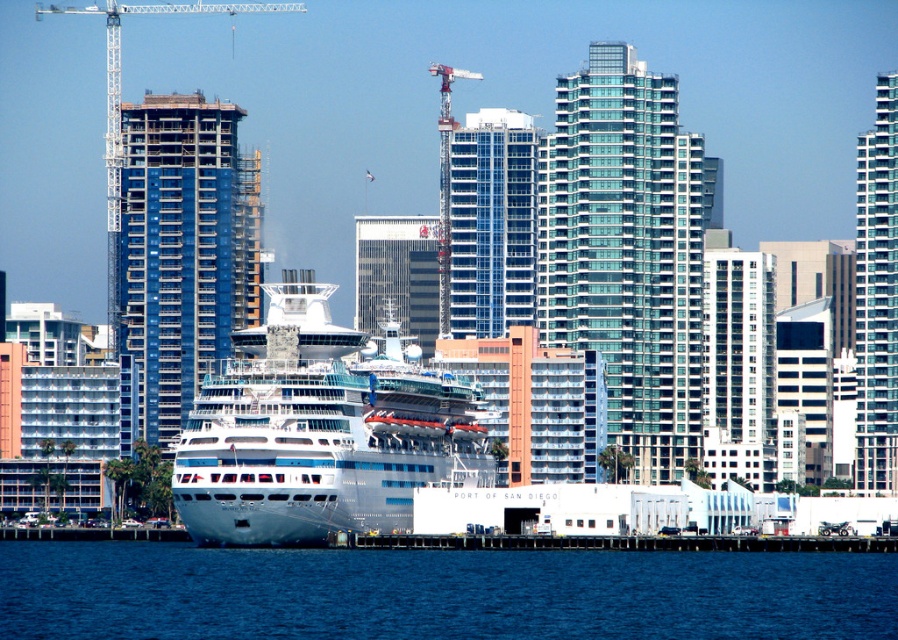
You are a drone operator tasked with flying a drone between the blue glass building at center and the glassy gray skyscraper at center. The drone has a wingspan of 1.5 meters. Can the drone safely navigate the space between them?

The blue glass building at center is 15.05 meters from the glassy gray skyscraper at center. Since the drone has a wingspan of 1.5 meters, it can safely navigate the space between them as the distance is much larger than the drone size.

You are a delivery drone operator. Your drone has a maximum flight range of 100 meters. You need to deliver a package from the metallic scaffolding at left to the transparent glass building at center. Can your drone complete this delivery without needing a recharge?

The transparent glass building at center is 95.46 meters away from metallic scaffolding at left. Since the drone has a maximum flight range of 100 meters, it can complete the delivery without needing a recharge as the distance is within its operational limit.